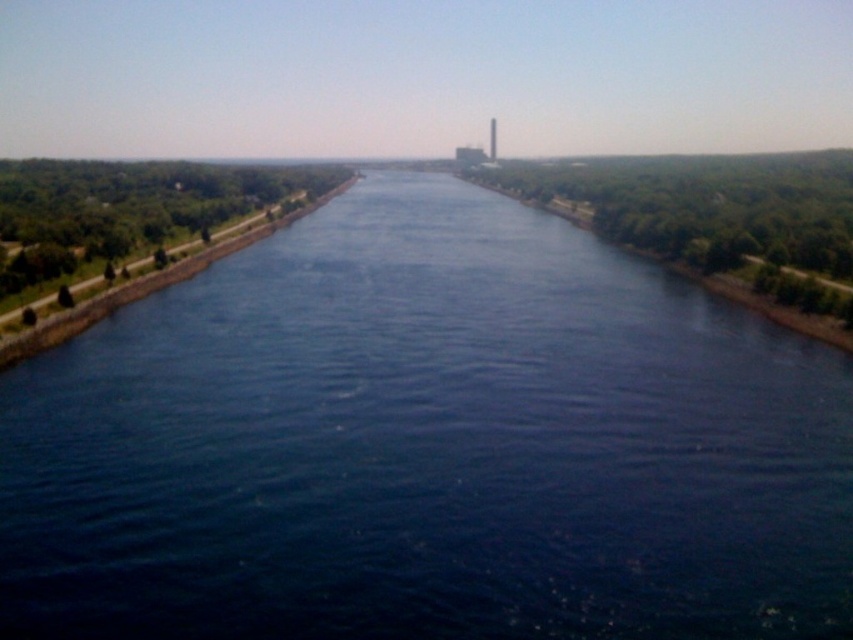
Is dark blue water at center bigger than smooth gray tower at center?

Correct, dark blue water at center is larger in size than smooth gray tower at center.

Is dark blue water at center to the left of smooth gray tower at center from the viewer's perspective?

Correct, you'll find dark blue water at center to the left of smooth gray tower at center.

Between point (483, 436) and point (492, 118), which one is positioned behind?

The point (492, 118) is more distant.

The height and width of the screenshot is (640, 853). Find the location of `dark blue water at center`. dark blue water at center is located at coordinates (428, 445).